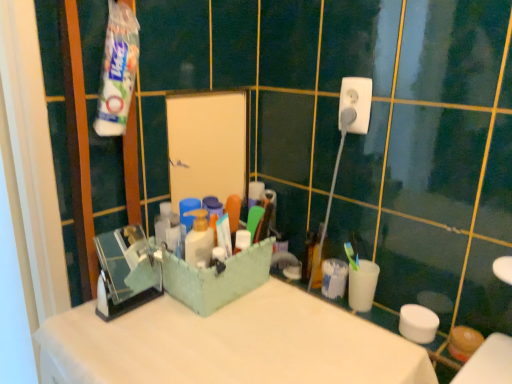
Image resolution: width=512 pixels, height=384 pixels. What do you see at coordinates (230, 344) in the screenshot? I see `white matte counter top at center` at bounding box center [230, 344].

Locate an element on the screen. The image size is (512, 384). white plastic socket at upper right is located at coordinates (355, 105).

Locate an element on the screen. Image resolution: width=512 pixels, height=384 pixels. white matte counter top at center is located at coordinates (230, 344).

Are white plastic cup at right and white plastic socket at upper right far apart?

No, white plastic cup at right is in close proximity to white plastic socket at upper right.

Considering the positions of objects white plastic cup at right and white plastic socket at upper right in the image provided, who is more to the left, white plastic cup at right or white plastic socket at upper right?

Positioned to the left is white plastic socket at upper right.

Is point (364, 309) closer or farther from the camera than point (371, 93)?

Point (364, 309) is positioned farther from the camera compared to point (371, 93).

Does white plastic cup at right have a lesser width compared to white plastic socket at upper right?

No.

Who is taller, white plastic cup at right or white matte counter top at center?

white matte counter top at center is taller.

Which of these two, white plastic cup at right or white matte counter top at center, is bigger?

With larger size is white matte counter top at center.

From the image's perspective, is white plastic cup at right located above or below white matte counter top at center?

Based on their image positions, white plastic cup at right is located above white matte counter top at center.

Is white plastic cup at right closer to camera compared to white matte counter top at center?

No, it is not.

In terms of height, does white matte counter top at center look taller or shorter compared to white plastic socket at upper right?

Considering their sizes, white matte counter top at center has more height than white plastic socket at upper right.

From a real-world perspective, does white matte counter top at center sit lower than white plastic socket at upper right?

Yes.

Is white matte counter top at center oriented towards white plastic socket at upper right?

No, white matte counter top at center is not oriented towards white plastic socket at upper right.

Is there a large distance between white matte counter top at center and white plastic socket at upper right?

white matte counter top at center is near white plastic socket at upper right, not far away.

Does white plastic socket at upper right turn towards white matte counter top at center?

No, white plastic socket at upper right is not facing towards white matte counter top at center.

Does white plastic socket at upper right have a lesser height compared to white matte counter top at center?

Yes.

Can you confirm if white plastic socket at upper right is positioned to the right of white matte counter top at center?

Correct, you'll find white plastic socket at upper right to the right of white matte counter top at center.

Looking at this image, does white matte counter top at center appear on the left side of white plastic cup at right?

Indeed, white matte counter top at center is positioned on the left side of white plastic cup at right.

Does point (176, 320) lie behind point (368, 309)?

No, it is not.

Considering the sizes of objects white matte counter top at center and white plastic cup at right in the image provided, who is wider, white matte counter top at center or white plastic cup at right?

With larger width is white matte counter top at center.

Is white matte counter top at center beside white plastic cup at right?

No, white matte counter top at center is not with white plastic cup at right.

Consider the image. From a real-world perspective, which is physically below, white plastic socket at upper right or white plastic cup at right?

In real-world perspective, white plastic cup at right is lower.

Based on the photo, between white plastic socket at upper right and white plastic cup at right, which one has more height?

white plastic cup at right.

Choose the correct answer: Is white plastic socket at upper right inside white plastic cup at right or outside it?

white plastic socket at upper right lies outside white plastic cup at right.

Looking at this image, from the image's perspective, is white plastic socket at upper right below white plastic cup at right?

No, from the image's perspective, white plastic socket at upper right is not beneath white plastic cup at right.

Locate an element on the screen. This screenshot has height=384, width=512. coffee cup located on the right of white plastic socket at upper right is located at coordinates (362, 285).

Locate an element on the screen. This screenshot has width=512, height=384. coffee cup that is above the white matte counter top at center (from a real-world perspective) is located at coordinates (362, 285).

Based on the photo, looking at the image, which one is located further to white plastic socket at upper right, white matte counter top at center or white plastic cup at right?

white matte counter top at center lies further to white plastic socket at upper right than the other object.

Considering their positions, is white plastic cup at right positioned closer to white plastic socket at upper right than white matte counter top at center?

white plastic cup at right is positioned closer to the anchor white plastic socket at upper right.

When comparing their distances from white matte counter top at center, does white plastic cup at right or white plastic socket at upper right seem closer?

Among the two, white plastic cup at right is located nearer to white matte counter top at center.

Which object lies further to the anchor point white plastic cup at right, white matte counter top at center or white plastic socket at upper right?

white plastic socket at upper right.

Looking at the image, which one is located closer to white plastic cup at right, white plastic socket at upper right or white matte counter top at center?

white matte counter top at center lies closer to white plastic cup at right than the other object.

When comparing their distances from white matte counter top at center, does white plastic socket at upper right or white plastic cup at right seem further?

white plastic socket at upper right lies further to white matte counter top at center than the other object.

Identify the location of coffee cup that lies between white plastic socket at upper right and white matte counter top at center from top to bottom. (362, 285).